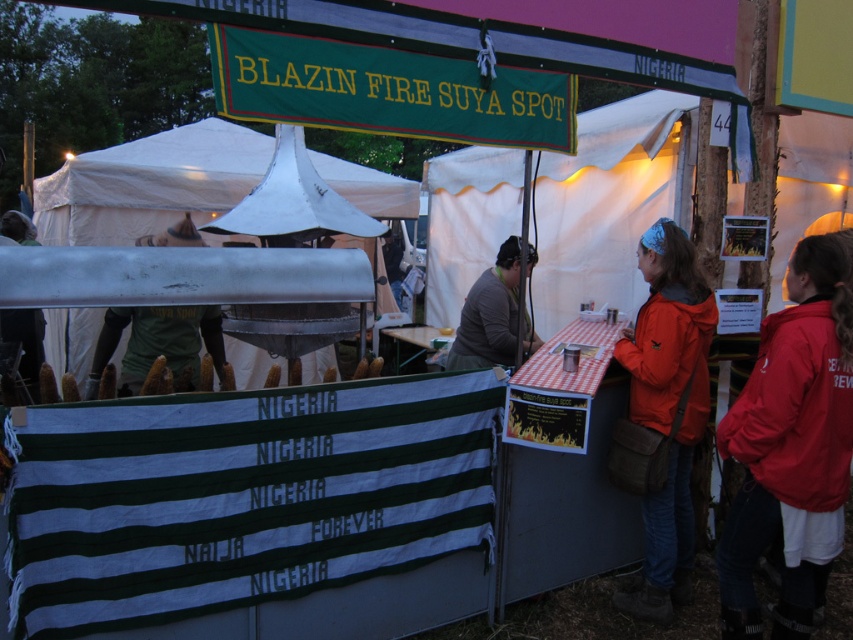
You are standing at the entrance of the food stall and want to find the white canvas tent at center. According to the coordinates provided in the Objects Description, in which direction should you look relative to your current position?

The white canvas tent at center is located at coordinates point (607, 204). Since the coordinate system typically has the origin at the bottom left corner, the tent is positioned to the right and above your current position at the entrance. Therefore, you should look towards the upper right direction from your current position.

You are a customer at the BLAZIN FIRE SUYA SPOT stall. You want to sit down to eat your meal. The metallic tent at center and the gray fabric at center are both in your view. Which one should you move towards to find a seating area?

The metallic tent at center is to the left of the gray fabric at center. Since the gray fabric at center is likely part of the stall structure, the metallic tent at center might be where seating is located. Move towards the metallic tent at center.